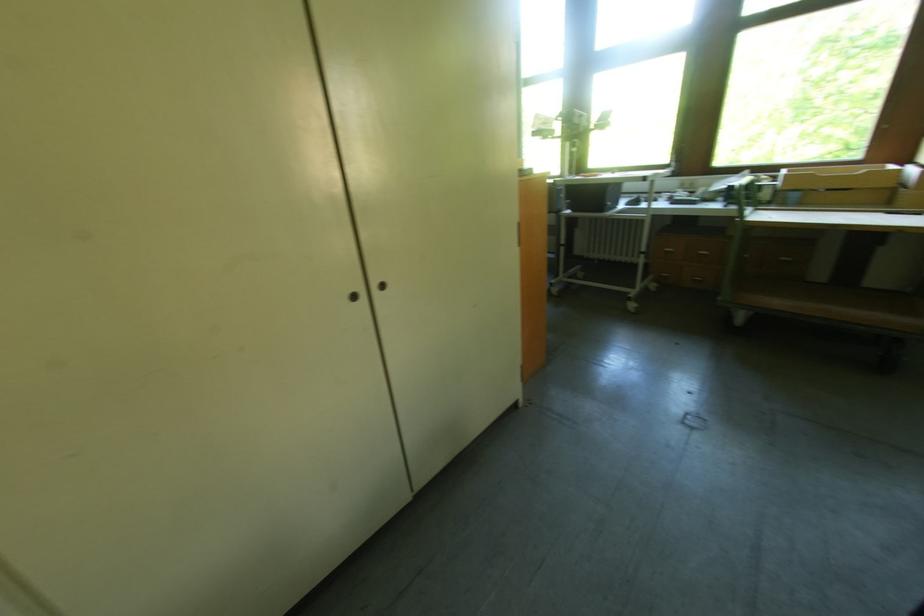
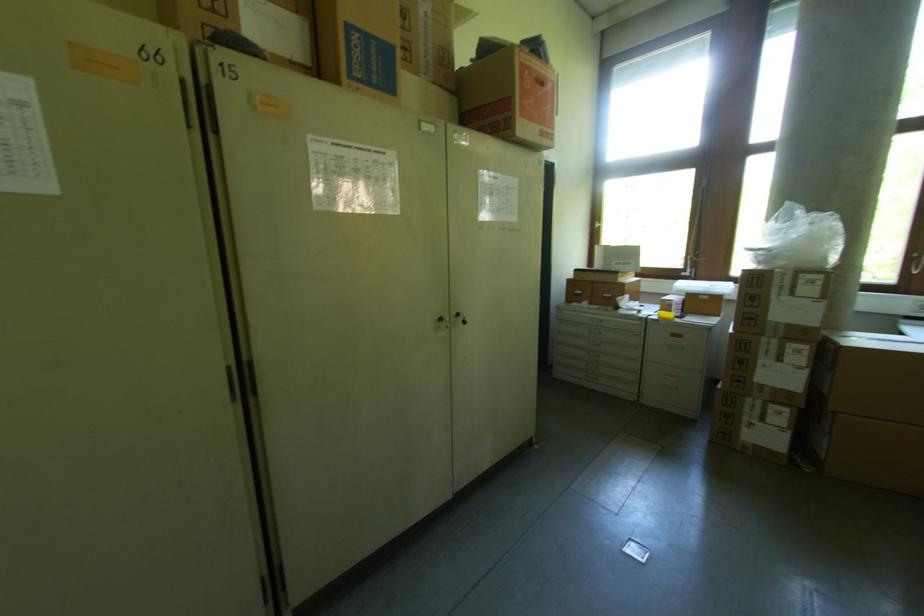
In a continuous first-person perspective shot, in which direction is the camera moving?

The movement direction of the cameraman is left, forward.